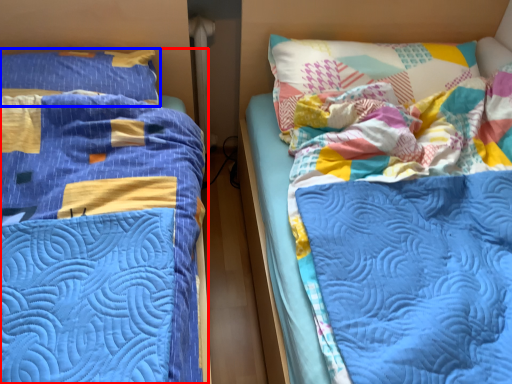
Question: Which object is closer to the camera taking this photo, bed (highlighted by a red box) or pillow (highlighted by a blue box)?

Choices:
 (A) bed
 (B) pillow

Answer: (A)